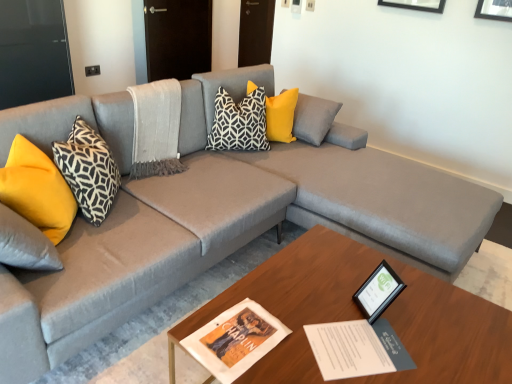
You are a GUI agent. You are given a task and a screenshot of the screen. Output one action in this format:
    pyautogui.click(x=<x>, y=<y>)
    Task: Click on the unoccupied space behind black glossy picture frame at lower right
    
    Given the screenshot: What is the action you would take?
    pyautogui.click(x=351, y=271)